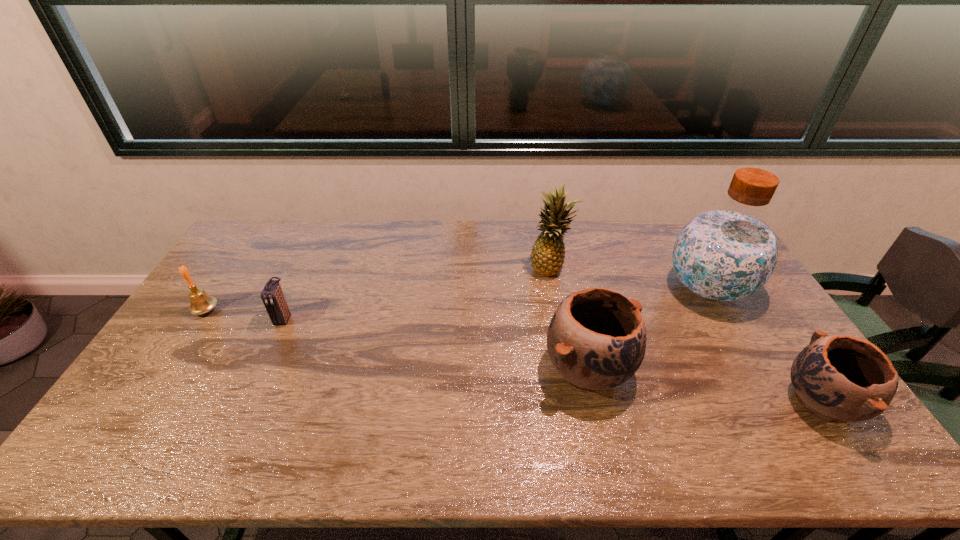
In the image, there is a desktop. Identify the location of vacant region at the near edge. (506, 407).

Locate an element on the screen. The height and width of the screenshot is (540, 960). vacant space in between the right pottery and the taller pottery is located at coordinates (705, 385).

The image size is (960, 540). Find the location of `empty space between the fifth shortest object and the shorter pottery`. empty space between the fifth shortest object and the shorter pottery is located at coordinates (685, 335).

Locate an element on the screen. This screenshot has width=960, height=540. free space between the pineapple and the leftmost object is located at coordinates (378, 289).

At what (x,y) coordinates should I click in order to perform the action: click on blank region between the water jug and the taller pottery. Please return your answer as a coordinate pair (x, y). The height and width of the screenshot is (540, 960). Looking at the image, I should click on (648, 328).

Locate an element on the screen. vacant region between the pineapple and the clutch bag is located at coordinates [x=418, y=293].

I want to click on empty location between the left pottery and the leftmost object, so click(397, 340).

The image size is (960, 540). Identify the location of free area in between the shorter pottery and the pineapple. (685, 335).

This screenshot has height=540, width=960. Find the location of `empty space between the clutch bag and the pineapple`. empty space between the clutch bag and the pineapple is located at coordinates (418, 293).

I want to click on empty location between the bell and the clutch bag, so click(245, 314).